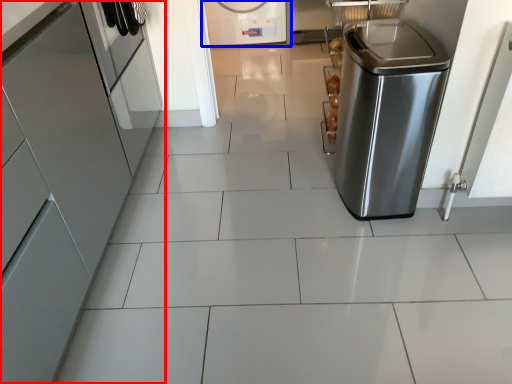
Question: Which point is further to the camera, home appliance (highlighted by a red box) or home appliance (highlighted by a blue box)?

Choices:
 (A) home appliance
 (B) home appliance

Answer: (B)